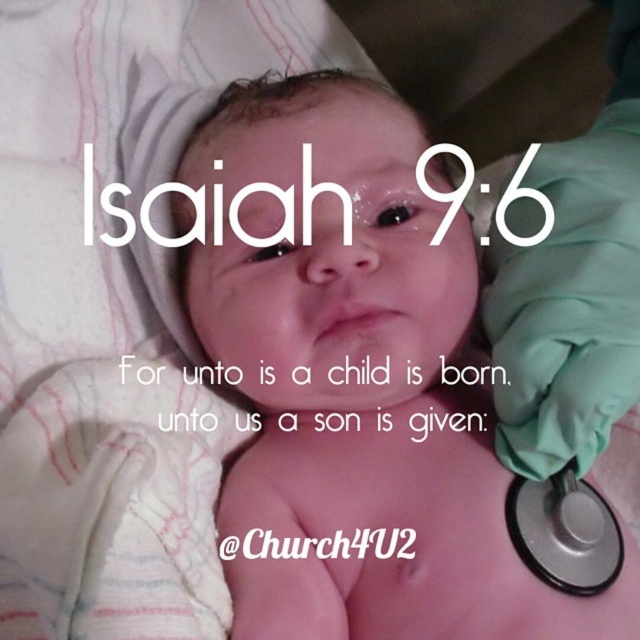
Can you confirm if white striped fabric at center is bigger than black rubber stethoscope at lower right?

Correct, white striped fabric at center is larger in size than black rubber stethoscope at lower right.

Which is more to the right, white striped fabric at center or black rubber stethoscope at lower right?

Positioned to the right is black rubber stethoscope at lower right.

Is point (99, 120) positioned after point (540, 563)?

Yes, point (99, 120) is behind point (540, 563).

Locate an element on the screen. The height and width of the screenshot is (640, 640). white striped fabric at center is located at coordinates (115, 310).

Does teal fabric stethoscope at right lie in front of black rubber stethoscope at lower right?

Yes.

Who is more forward, [577,168] or [579,557]?

Point [579,557] is more forward.

This screenshot has width=640, height=640. I want to click on teal fabric stethoscope at right, so click(572, 285).

Locate an element on the screen. The image size is (640, 640). teal fabric stethoscope at right is located at coordinates (572, 285).

Who is lower down, pink smooth skin at center or teal fabric stethoscope at right?

Positioned lower is pink smooth skin at center.

Does pink smooth skin at center appear on the left side of teal fabric stethoscope at right?

Yes, pink smooth skin at center is to the left of teal fabric stethoscope at right.

Is point (444, 564) farther from viewer compared to point (612, 276)?

Yes, point (444, 564) is farther from viewer.

This screenshot has height=640, width=640. Identify the location of pink smooth skin at center. (346, 372).